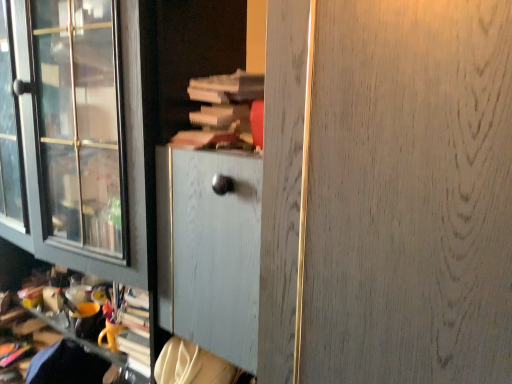
Where is `wooden book at center`? The width and height of the screenshot is (512, 384). wooden book at center is located at coordinates (226, 112).

What is the approximate height of wooden book at center?

wooden book at center is 6.29 inches tall.

This screenshot has height=384, width=512. What do you see at coordinates (226, 112) in the screenshot? I see `wooden book at center` at bounding box center [226, 112].

What do you see at coordinates (409, 194) in the screenshot? I see `white wood screen door at center` at bounding box center [409, 194].

Measure the distance between white wood screen door at center and camera.

The distance of white wood screen door at center from camera is 14.35 inches.

The image size is (512, 384). In order to click on white wood screen door at center in this screenshot , I will do (x=409, y=194).

Identify the location of wooden book at center. This screenshot has height=384, width=512. (226, 112).

Considering the positions of objects white wood screen door at center and wooden book at center in the image provided, who is more to the right, white wood screen door at center or wooden book at center?

white wood screen door at center is more to the right.

Which object is further away from the camera taking this photo, white wood screen door at center or wooden book at center?

wooden book at center is behind.

Does point (362, 255) come in front of point (219, 120)?

Yes.

From the image's perspective, does white wood screen door at center appear higher than wooden book at center?

No, from the image's perspective, white wood screen door at center is not on top of wooden book at center.

From a real-world perspective, who is located lower, white wood screen door at center or wooden book at center?

From a 3D spatial view, white wood screen door at center is below.

Which object is thinner, white wood screen door at center or wooden book at center?

wooden book at center.

In terms of height, does white wood screen door at center look taller or shorter compared to wooden book at center?

white wood screen door at center is taller than wooden book at center.

Between white wood screen door at center and wooden book at center, which one has smaller size?

wooden book at center.

Which is correct: white wood screen door at center is inside wooden book at center, or outside of it?

white wood screen door at center exists outside the volume of wooden book at center.

Is white wood screen door at center far from wooden book at center?

No, white wood screen door at center is in close proximity to wooden book at center.

Is white wood screen door at center facing away from wooden book at center?

No, white wood screen door at center is not facing away from wooden book at center.

What's the angular difference between white wood screen door at center and wooden book at center's facing directions?

The facing directions of white wood screen door at center and wooden book at center are 3.64 degrees apart.

Locate an element on the screen. The image size is (512, 384). book located on the left of white wood screen door at center is located at coordinates (226, 112).

Considering the positions of objects wooden book at center and white wood screen door at center in the image provided, who is more to the right, wooden book at center or white wood screen door at center?

white wood screen door at center.

In the scene shown: Which is in front, wooden book at center or white wood screen door at center?

white wood screen door at center is more forward.

Between point (236, 116) and point (419, 123), which one is positioned behind?

The point (236, 116) is more distant.

From the image's perspective, is wooden book at center above or below white wood screen door at center?

From the image's perspective, wooden book at center appears above white wood screen door at center.

From a real-world perspective, is wooden book at center physically located above or below white wood screen door at center?

Clearly, from a real-world perspective, wooden book at center is above white wood screen door at center.

Which object is wider, wooden book at center or white wood screen door at center?

white wood screen door at center is wider.

Does wooden book at center have a lesser height compared to white wood screen door at center?

Yes.

Who is bigger, wooden book at center or white wood screen door at center?

Bigger between the two is white wood screen door at center.

Can white wood screen door at center be found inside wooden book at center?

No, white wood screen door at center is not a part of wooden book at center.

Would you say wooden book at center is a long distance from white wood screen door at center?

No, there isn't a large distance between wooden book at center and white wood screen door at center.

Is wooden book at center aimed at white wood screen door at center?

No, wooden book at center is not turned towards white wood screen door at center.

The height and width of the screenshot is (384, 512). I want to click on screen door that appears below the wooden book at center (from the image's perspective), so click(x=409, y=194).

Where is `screen door that appears below the wooden book at center (from the image's perspective)`? The height and width of the screenshot is (384, 512). screen door that appears below the wooden book at center (from the image's perspective) is located at coordinates (409, 194).

This screenshot has height=384, width=512. Identify the location of book that appears above the white wood screen door at center (from a real-world perspective). (226, 112).